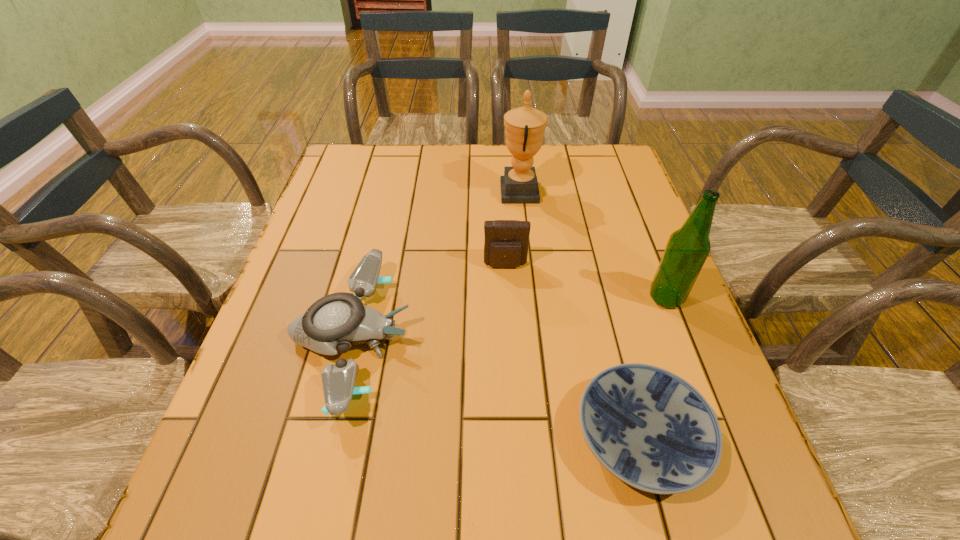
Image resolution: width=960 pixels, height=540 pixels. In order to click on object at the near right corner in this screenshot , I will do `click(653, 430)`.

This screenshot has width=960, height=540. Identify the location of vacant area at the far edge of the desktop. (492, 157).

You are a GUI agent. You are given a task and a screenshot of the screen. Output one action in this format:
    pyautogui.click(x=<x>, y=<y>)
    Task: Click on the vacant space at the near edge of the desktop
    
    Given the screenshot: What is the action you would take?
    pyautogui.click(x=674, y=539)

This screenshot has width=960, height=540. I want to click on free space at the left edge of the desktop, so click(x=317, y=410).

Where is `vacant space at the right edge`? Image resolution: width=960 pixels, height=540 pixels. vacant space at the right edge is located at coordinates (629, 270).

Locate an element on the screen. vacant area at the far left corner is located at coordinates (341, 148).

In order to click on vacant space at the far right corner of the desktop in this screenshot , I will do `click(608, 147)`.

The height and width of the screenshot is (540, 960). I want to click on vacant region at the near right corner of the desktop, so click(756, 524).

Identify the location of empty space that is in between the farthest object and the second shortest object. This screenshot has width=960, height=540. (436, 265).

Identify the location of vacant space that is in between the beer bottle and the farthest object. (593, 245).